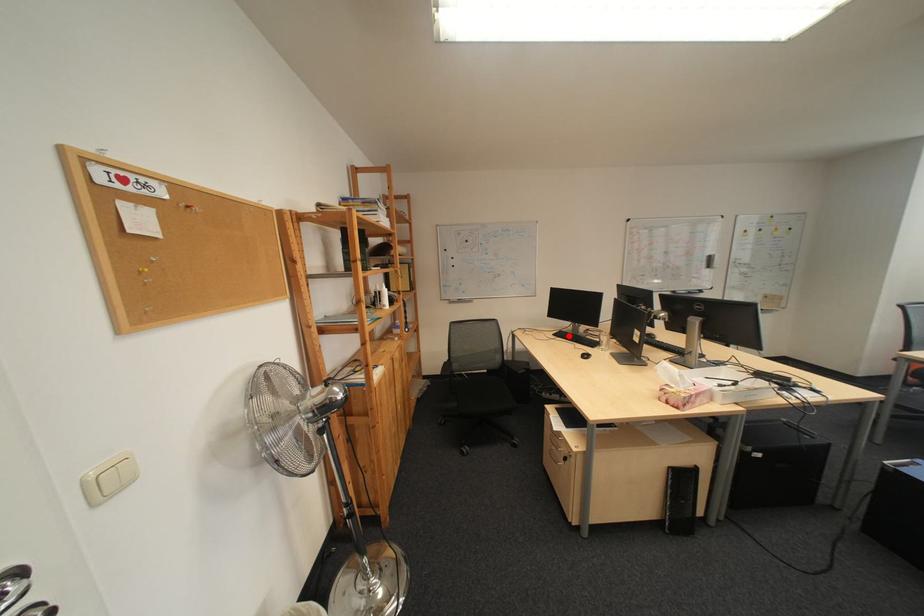
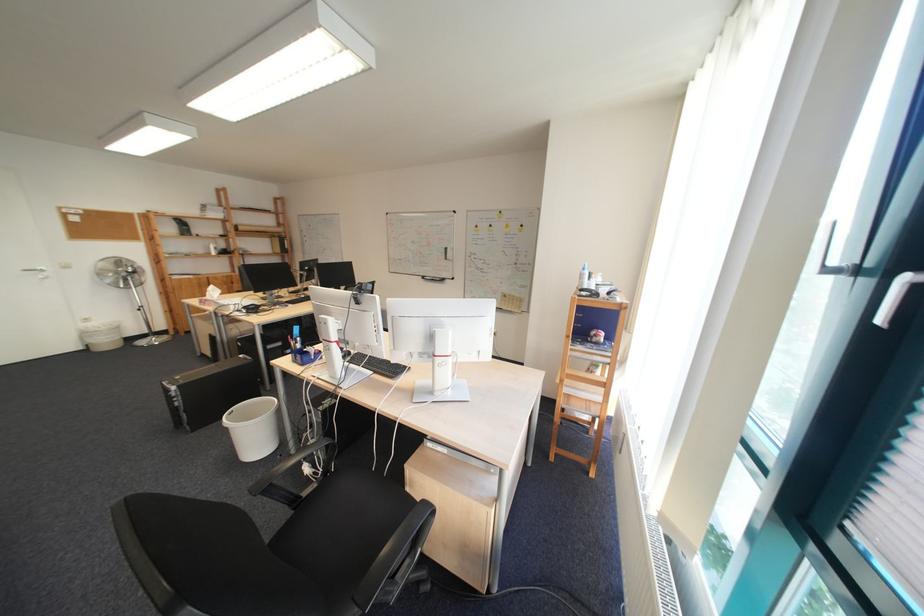
Question: I am providing you with two images of the same scene from different viewpoints. A red point is marked on the first image. At the location where the point appears in image 1, is it still visible in image 2?

Choices:
 (A) Yes
 (B) No

Answer: (B)